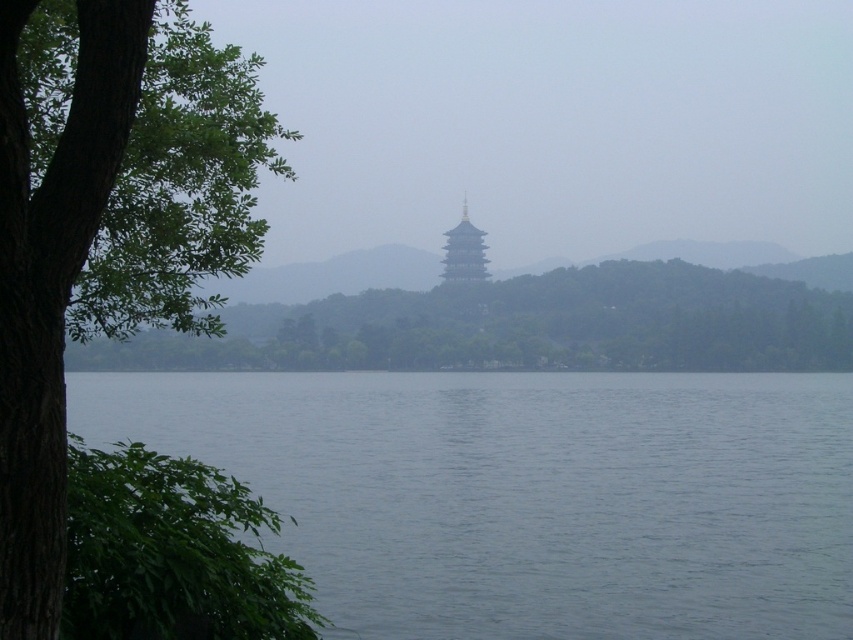
You are standing at the edge of the gray water at center and want to walk to the green leafy tree at left. Which direction should you face to see the tree without the water blocking your view?

Since the green leafy tree at left is behind the gray water at center, you should face towards the left direction to see the tree without the water blocking your view.

Based on the photo, you are an observer standing at the edge of the scene. You notice the gray water at center and the green leafy tree at center. Which object appears narrower from your viewpoint?

The gray water at center appears narrower than the green leafy tree at center from the observer viewpoint.